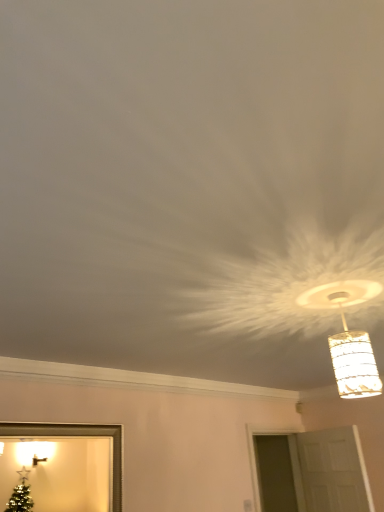
The image size is (384, 512). What do you see at coordinates (353, 360) in the screenshot?
I see `translucent glass pendant light at upper right` at bounding box center [353, 360].

What do you see at coordinates (77, 435) in the screenshot? This screenshot has width=384, height=512. I see `gold metallic picture frame at lower left` at bounding box center [77, 435].

Identify the location of white matte door at lower right. The image size is (384, 512). (309, 471).

Find the location of a particular element. translucent glass pendant light at upper right is located at coordinates (353, 360).

Considering the sizes of translucent glass pendant light at upper right and white matte door at lower right in the image, is translucent glass pendant light at upper right taller or shorter than white matte door at lower right?

In the image, translucent glass pendant light at upper right appears to be shorter than white matte door at lower right.

Between translucent glass pendant light at upper right and white matte door at lower right, which one has larger width?

With larger width is translucent glass pendant light at upper right.

Measure the distance between translucent glass pendant light at upper right and white matte door at lower right.

2.44 meters.

Could you tell me if translucent glass pendant light at upper right is facing white matte door at lower right?

No, translucent glass pendant light at upper right is not aimed at white matte door at lower right.

Looking at their sizes, would you say white matte door at lower right is wider or thinner than translucent glass pendant light at upper right?

In the image, white matte door at lower right appears to be more narrow than translucent glass pendant light at upper right.

Measure the distance between white matte door at lower right and translucent glass pendant light at upper right.

white matte door at lower right and translucent glass pendant light at upper right are 2.44 meters apart.

Considering the relative sizes of white matte door at lower right and translucent glass pendant light at upper right in the image provided, is white matte door at lower right shorter than translucent glass pendant light at upper right?

No, white matte door at lower right is not shorter than translucent glass pendant light at upper right.

Considering the positions of point (267, 503) and point (330, 345), is point (267, 503) closer or farther from the camera than point (330, 345)?

Point (267, 503) appears to be farther away from the viewer than point (330, 345).

Which is closer, (268, 440) or (109, 432)?

Point (268, 440) is farther from the camera than point (109, 432).

Consider the image. Between white matte door at lower right and gold metallic picture frame at lower left, which one appears on the right side from the viewer's perspective?

white matte door at lower right is more to the right.

From a real-world perspective, relative to gold metallic picture frame at lower left, is white matte door at lower right vertically above or below?

Clearly, from a real-world perspective, white matte door at lower right is below gold metallic picture frame at lower left.

Is there a large distance between white matte door at lower right and gold metallic picture frame at lower left?

Yes.

Considering the points (345, 331) and (114, 429), which point is in front, point (345, 331) or point (114, 429)?

The point (345, 331) is closer.

Is translucent glass pendant light at upper right oriented towards gold metallic picture frame at lower left?

No, translucent glass pendant light at upper right is not turned towards gold metallic picture frame at lower left.

From the picture: Considering the sizes of objects translucent glass pendant light at upper right and gold metallic picture frame at lower left in the image provided, who is smaller, translucent glass pendant light at upper right or gold metallic picture frame at lower left?

With smaller size is translucent glass pendant light at upper right.

Between translucent glass pendant light at upper right and gold metallic picture frame at lower left, which one has more height?

gold metallic picture frame at lower left is taller.

How much distance is there between gold metallic picture frame at lower left and white matte door at lower right?

A distance of 1.98 meters exists between gold metallic picture frame at lower left and white matte door at lower right.

Is gold metallic picture frame at lower left directly adjacent to white matte door at lower right?

No, gold metallic picture frame at lower left is not touching white matte door at lower right.

Is gold metallic picture frame at lower left facing away from white matte door at lower right?

gold metallic picture frame at lower left does not have its back to white matte door at lower right.

Is gold metallic picture frame at lower left in front of or behind white matte door at lower right in the image?

gold metallic picture frame at lower left is in front of white matte door at lower right.

Considering the positions of objects gold metallic picture frame at lower left and translucent glass pendant light at upper right in the image provided, who is more to the left, gold metallic picture frame at lower left or translucent glass pendant light at upper right?

Positioned to the left is gold metallic picture frame at lower left.

In the scene shown: Could you tell me if gold metallic picture frame at lower left is facing translucent glass pendant light at upper right?

Yes, gold metallic picture frame at lower left faces towards translucent glass pendant light at upper right.

Which object is closer to the camera, gold metallic picture frame at lower left or translucent glass pendant light at upper right?

translucent glass pendant light at upper right is closer to the camera.

Looking at this image, are gold metallic picture frame at lower left and translucent glass pendant light at upper right far apart?

Yes, gold metallic picture frame at lower left is far from translucent glass pendant light at upper right.

Identify the location of window that is on the right side of translucent glass pendant light at upper right. This screenshot has width=384, height=512. (309, 471).

I want to click on window that is behind the translucent glass pendant light at upper right, so click(309, 471).

Looking at the image, which one is located closer to translucent glass pendant light at upper right, gold metallic picture frame at lower left or white matte door at lower right?

gold metallic picture frame at lower left.

Looking at the image, which one is located further to gold metallic picture frame at lower left, white matte door at lower right or translucent glass pendant light at upper right?

white matte door at lower right lies further to gold metallic picture frame at lower left than the other object.

Considering their positions, is white matte door at lower right positioned closer to translucent glass pendant light at upper right than gold metallic picture frame at lower left?

The object closer to translucent glass pendant light at upper right is gold metallic picture frame at lower left.

Considering their positions, is translucent glass pendant light at upper right positioned closer to gold metallic picture frame at lower left than white matte door at lower right?

translucent glass pendant light at upper right.

Which object lies further to the anchor point white matte door at lower right, translucent glass pendant light at upper right or gold metallic picture frame at lower left?

Based on the image, translucent glass pendant light at upper right appears to be further to white matte door at lower right.

Based on their spatial positions, is gold metallic picture frame at lower left or translucent glass pendant light at upper right further from white matte door at lower right?

The object further to white matte door at lower right is translucent glass pendant light at upper right.

Locate an element on the screen. lamp located between gold metallic picture frame at lower left and white matte door at lower right in the left-right direction is located at coordinates (353, 360).